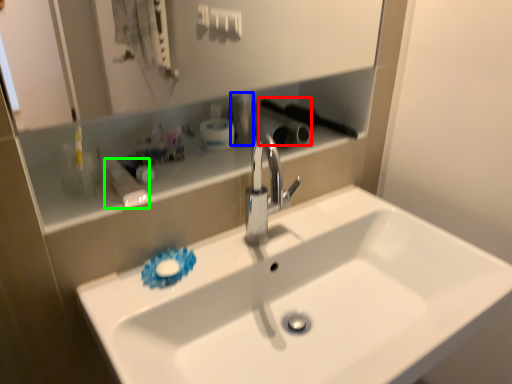
Question: Estimate the real-world distances between objects in this image. Which object is closer to brush (highlighted by a red box), toiletry (highlighted by a blue box) or toiletry (highlighted by a green box)?

Choices:
 (A) toiletry
 (B) toiletry

Answer: (A)